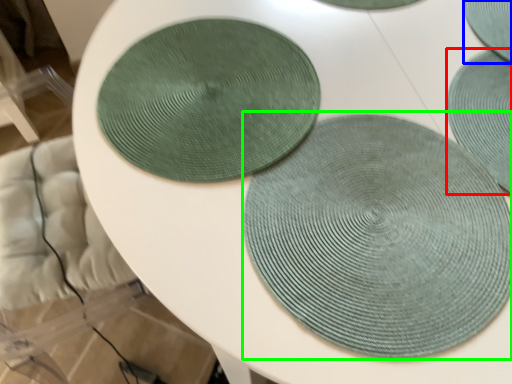
Question: Based on their relative distances, which object is farther from mat (highlighted by a red box)? Choose from coaster (highlighted by a blue box) and mat (highlighted by a green box).

Choices:
 (A) coaster
 (B) mat

Answer: (B)